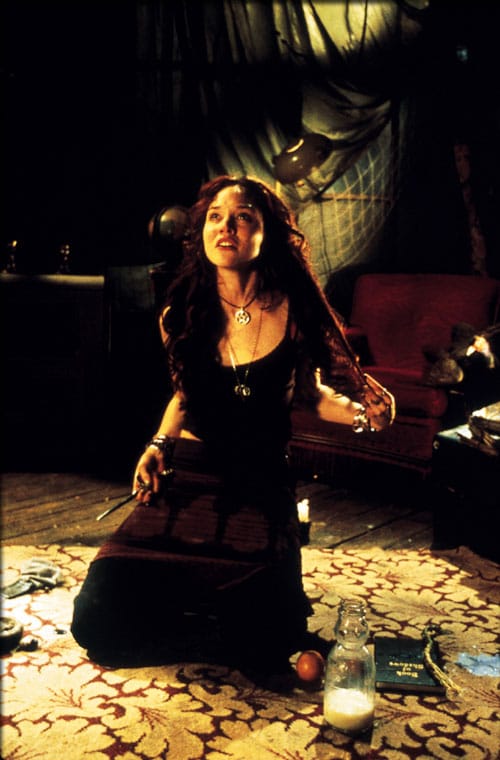
At what (x,y) coordinates should I click in order to perform the action: click on brown wood floor. Please return your answer as a coordinate pair (x, y). This screenshot has height=760, width=500. Looking at the image, I should click on (x=61, y=511).